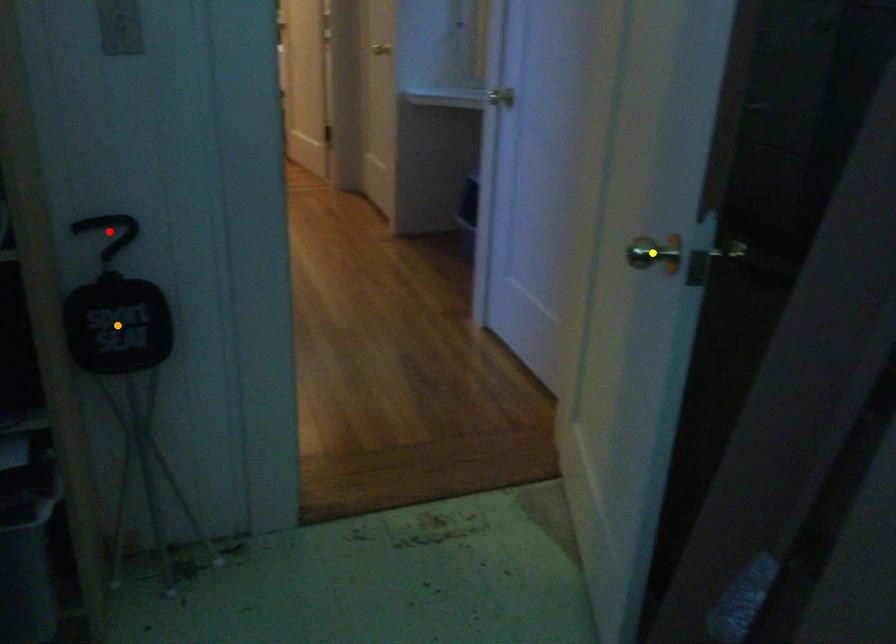
Order these from nearest to farthest:
yellow point | orange point | red point

yellow point, red point, orange point